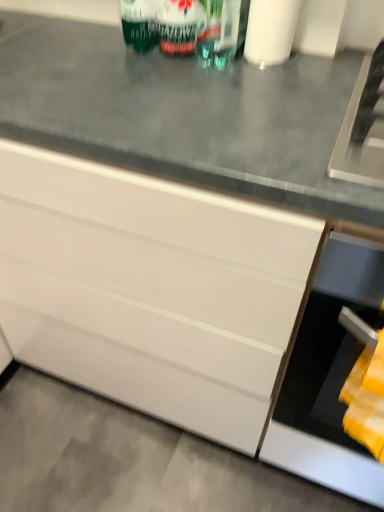
At what (x,y) coordinates should I click in order to perform the action: click on vacant region to the right of white matte toilet paper at upper center. Please return your answer as a coordinate pair (x, y). The image size is (384, 512). Looking at the image, I should click on (328, 60).